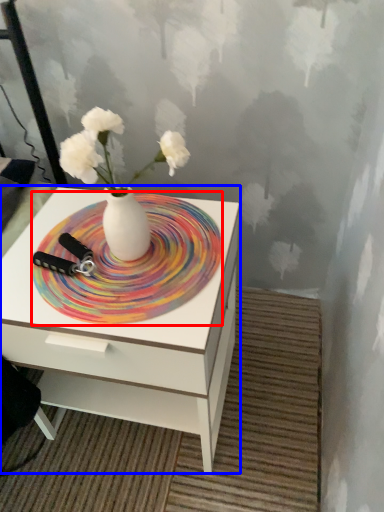
Question: Among these objects, which one is farthest to the camera, plate (highlighted by a red box) or nightstand (highlighted by a blue box)?

Choices:
 (A) plate
 (B) nightstand

Answer: (A)